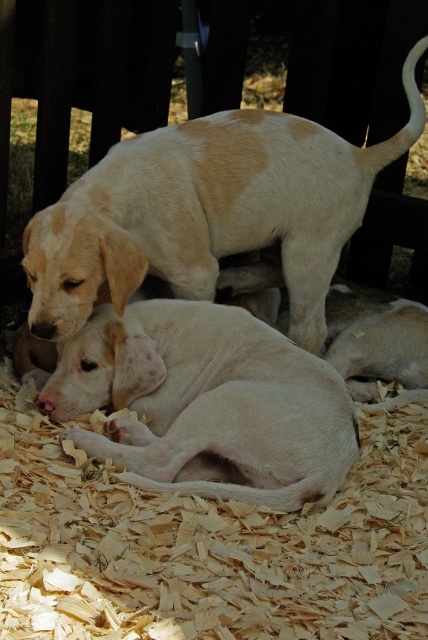
Question: Observing the image, what is the correct spatial positioning of light brown fur at upper center in reference to light beige fur at center?

Choices:
 (A) below
 (B) above

Answer: (B)

Question: Does light brown woodchip at lower center appear on the left side of light beige fur at center?

Choices:
 (A) yes
 (B) no

Answer: (A)

Question: Which point is closer to the camera?

Choices:
 (A) light brown fur at upper center
 (B) light beige fur at center
 (C) light brown woodchip at lower center

Answer: (C)

Question: Does light brown woodchip at lower center have a greater width compared to light beige fur at center?

Choices:
 (A) yes
 (B) no

Answer: (A)

Question: Which of these objects is positioned closest to the light brown woodchip at lower center?

Choices:
 (A) light beige fur at center
 (B) light brown fur at upper center

Answer: (A)

Question: Which of the following is the closest to the observer?

Choices:
 (A) light brown fur at upper center
 (B) light brown woodchip at lower center

Answer: (B)